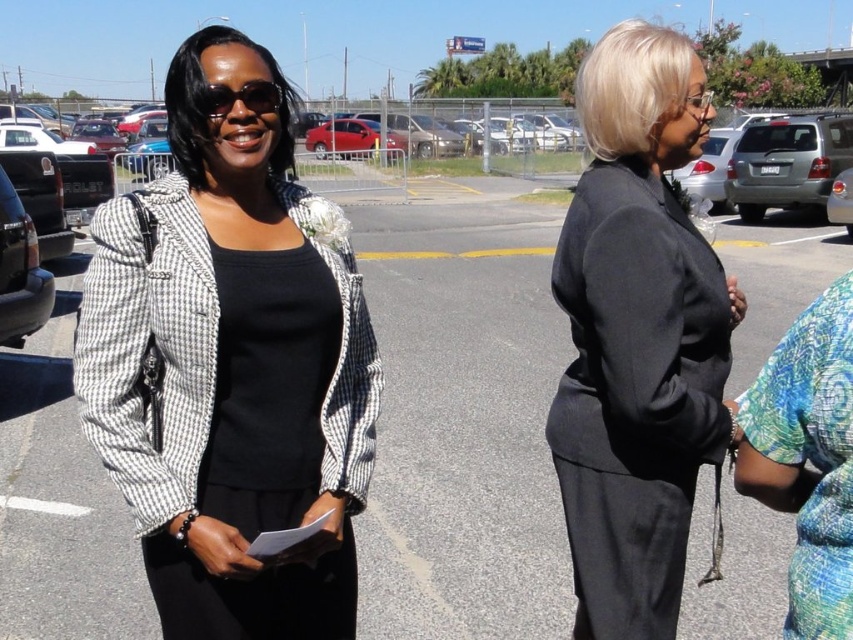
Between houndstooth fabric jacket at left and matte black sunglasses at upper left, which one appears on the right side from the viewer's perspective?

matte black sunglasses at upper left is more to the right.

Is point (213, 525) positioned after point (241, 88)?

That is False.

Does point (357, 374) lie behind point (225, 88)?

Yes, point (357, 374) is farther from viewer.

Locate an element on the screen. The width and height of the screenshot is (853, 640). houndstooth fabric jacket at left is located at coordinates [x=233, y=368].

Between houndstooth fabric jacket at left and black matte suit at right, which one has more height?

black matte suit at right

How far apart are houndstooth fabric jacket at left and black matte suit at right?

houndstooth fabric jacket at left is 32.95 inches from black matte suit at right.

Identify the location of houndstooth fabric jacket at left. The width and height of the screenshot is (853, 640). (233, 368).

From the picture: Does silver metallic suv at right have a lesser height compared to shiny red sedan at center?

In fact, silver metallic suv at right may be taller than shiny red sedan at center.

Does silver metallic suv at right lie in front of shiny red sedan at center?

Answer: Yes, it is in front of shiny red sedan at center.

Is point (772, 136) positioned before point (341, 157)?

Yes, point (772, 136) is in front of point (341, 157).

The width and height of the screenshot is (853, 640). I want to click on silver metallic suv at right, so click(x=787, y=163).